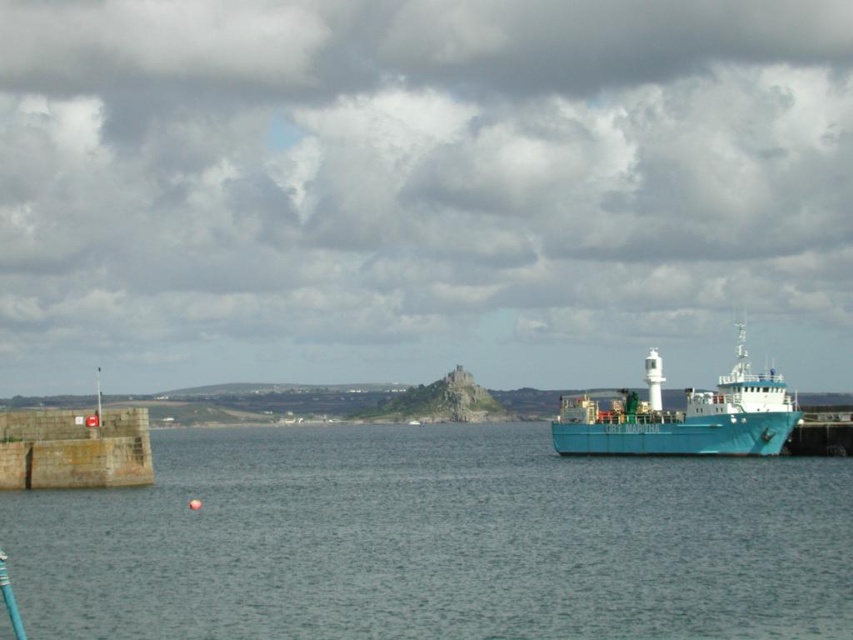
Question: Which point is farther to the camera?

Choices:
 (A) teal matte ship at right
 (B) blue water at center

Answer: (A)

Question: Observing the image, what is the correct spatial positioning of blue water at center in reference to teal matte ship at right?

Choices:
 (A) right
 (B) left

Answer: (B)

Question: Is blue water at center positioned in front of teal matte ship at right?

Choices:
 (A) no
 (B) yes

Answer: (B)

Question: Can you confirm if blue water at center is bigger than teal matte ship at right?

Choices:
 (A) yes
 (B) no

Answer: (B)

Question: Which object appears farthest from the camera in this image?

Choices:
 (A) blue water at center
 (B) teal matte ship at right

Answer: (B)